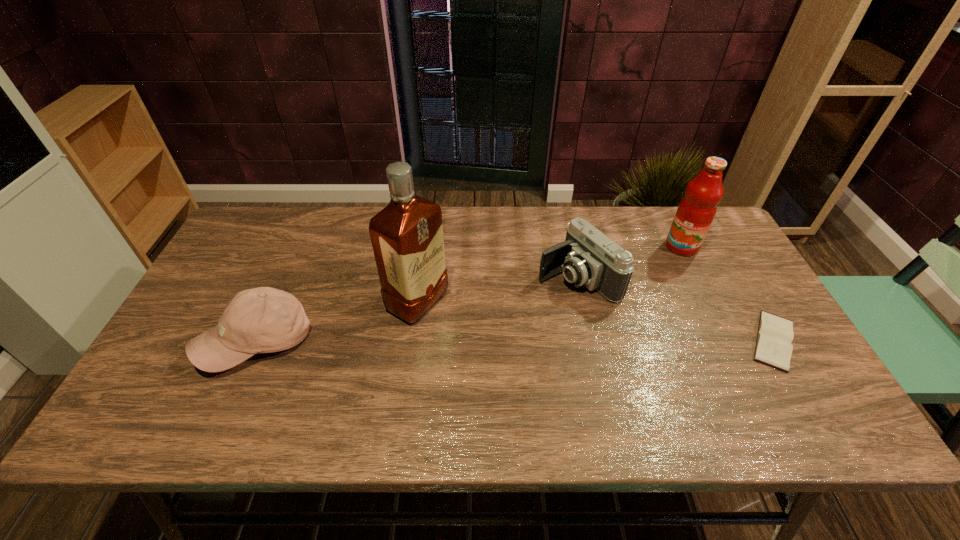
Locate an element on the screen. the leftmost object is located at coordinates (261, 320).

Where is `diary`? Image resolution: width=960 pixels, height=540 pixels. diary is located at coordinates (775, 333).

I want to click on the fourth object from right to left, so click(407, 238).

Identify the location of liquor. The image size is (960, 540). (407, 238).

Find the location of `the fourth shortest object`. the fourth shortest object is located at coordinates (696, 211).

The width and height of the screenshot is (960, 540). What are the coordinates of `the third object from right to left` in the screenshot? It's located at (588, 257).

The image size is (960, 540). I want to click on free space located 0.260m on the back of the shortest object, so click(x=719, y=248).

Locate an element on the screen. The height and width of the screenshot is (540, 960). free space located on the front label of the tallest object is located at coordinates (519, 361).

Identify the location of free space located on the front label of the tallest object. (533, 369).

The height and width of the screenshot is (540, 960). What are the coordinates of `vacant space positioned on the front label of the tallest object` in the screenshot? It's located at (519, 361).